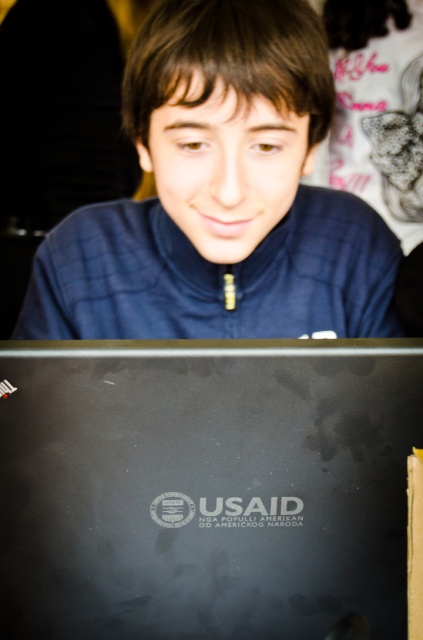
You are organizing a workspace and need to determine if the black matte laptop at lower center can fit entirely within the space currently occupied by the matte blue jacket at center. Based on their sizes, will it fit?

The black matte laptop at lower center occupies less space than the matte blue jacket at center, so it can fit within the space currently occupied by the matte blue jacket at center.

You are a photographer adjusting the camera focus. You notice two points in the image at coordinates point (x=5, y=432) and point (x=296, y=188). Which point should you focus on to ensure the subject in the foreground is sharp?

You should focus on point (x=5, y=432) because it is in front of point (x=296, y=188), making it closer to the camera and part of the foreground subject.